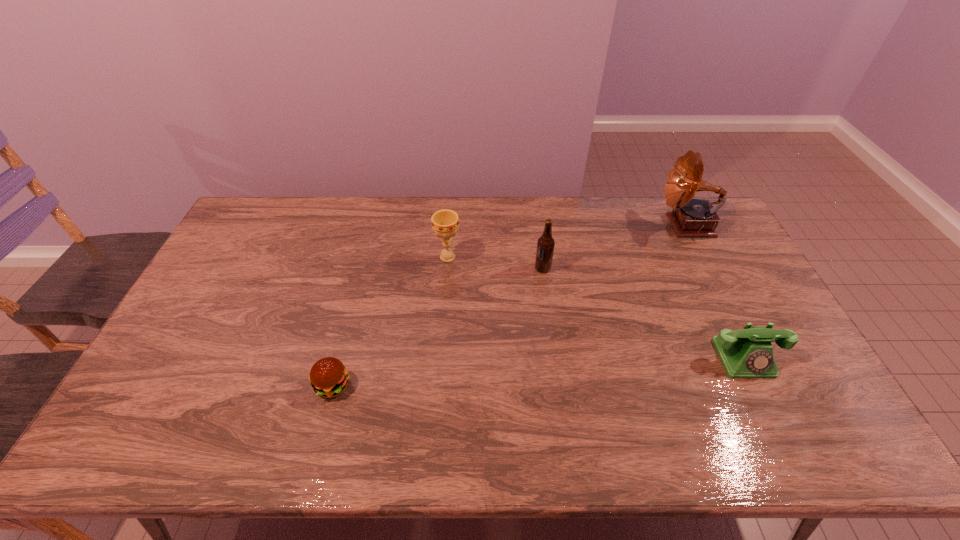
The width and height of the screenshot is (960, 540). I want to click on vacant space positioned 0.140m on the horn of the farthest object, so click(x=620, y=225).

Identify the location of vacant space situated on the horn of the farthest object. (625, 225).

The width and height of the screenshot is (960, 540). I want to click on free space located 0.140m on the label of the second tallest object, so click(x=492, y=268).

The width and height of the screenshot is (960, 540). What are the coordinates of `free region located 0.210m on the label of the second tallest object` in the screenshot? It's located at (471, 268).

You are a GUI agent. You are given a task and a screenshot of the screen. Output one action in this format:
    pyautogui.click(x=<x>, y=<y>)
    Task: Click on the free space located on the label of the second tallest object
    Image resolution: width=960 pixels, height=540 pixels.
    Given the screenshot: What is the action you would take?
    pyautogui.click(x=453, y=268)

Locate an element on the screen. This screenshot has width=960, height=540. vacant space situated on the left of the second object from left to right is located at coordinates (384, 257).

You are a GUI agent. You are given a task and a screenshot of the screen. Output one action in this format:
    pyautogui.click(x=<x>, y=<y>)
    Task: Click on the vacant space located 0.190m on the dial of the telephone
    The height and width of the screenshot is (540, 960).
    Given the screenshot: What is the action you would take?
    pyautogui.click(x=789, y=450)

At what (x,y) coordinates should I click in order to perform the action: click on free location located on the right of the leftmost object. Please return your answer as a coordinate pair (x, y). The width and height of the screenshot is (960, 540). Looking at the image, I should click on (413, 386).

At what (x,y) coordinates should I click in order to perform the action: click on object that is at the far edge. Please return your answer as a coordinate pair (x, y). Image resolution: width=960 pixels, height=540 pixels. Looking at the image, I should click on (692, 217).

Identify the location of phonograph_record that is positioned at the right edge. (692, 217).